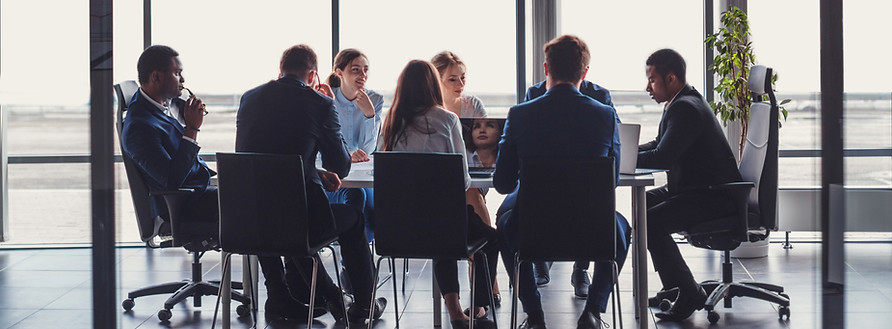
You are a GUI agent. You are given a task and a screenshot of the screen. Output one action in this format:
    pyautogui.click(x=<x>, y=<y>)
    Task: Click on the table legs
    The image size is (892, 329).
    Given the screenshot: What is the action you would take?
    pyautogui.click(x=640, y=279), pyautogui.click(x=637, y=257), pyautogui.click(x=254, y=271), pyautogui.click(x=245, y=280)